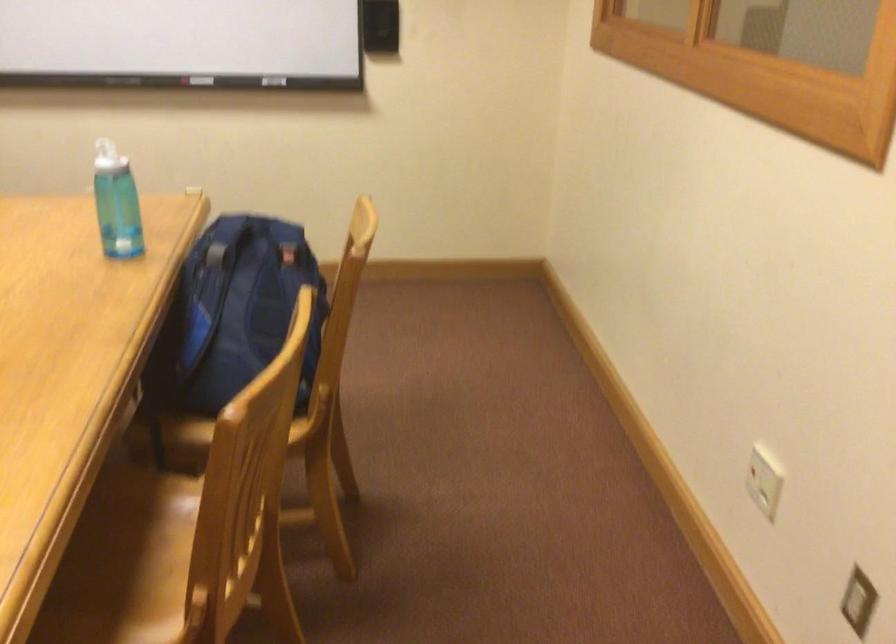
Where would you sit the chair sitting surface? Please return your answer as a coordinate pair (x, y).

(149, 550)